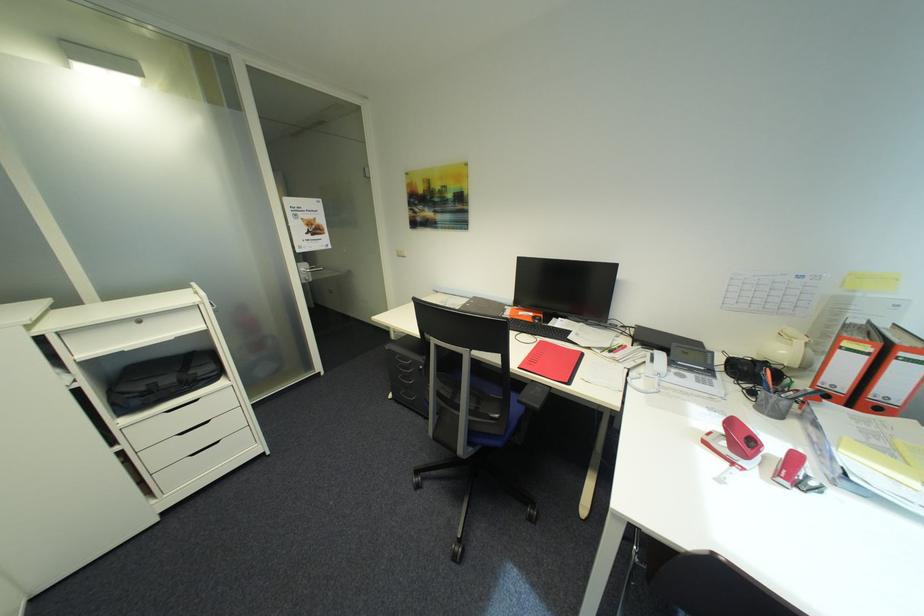
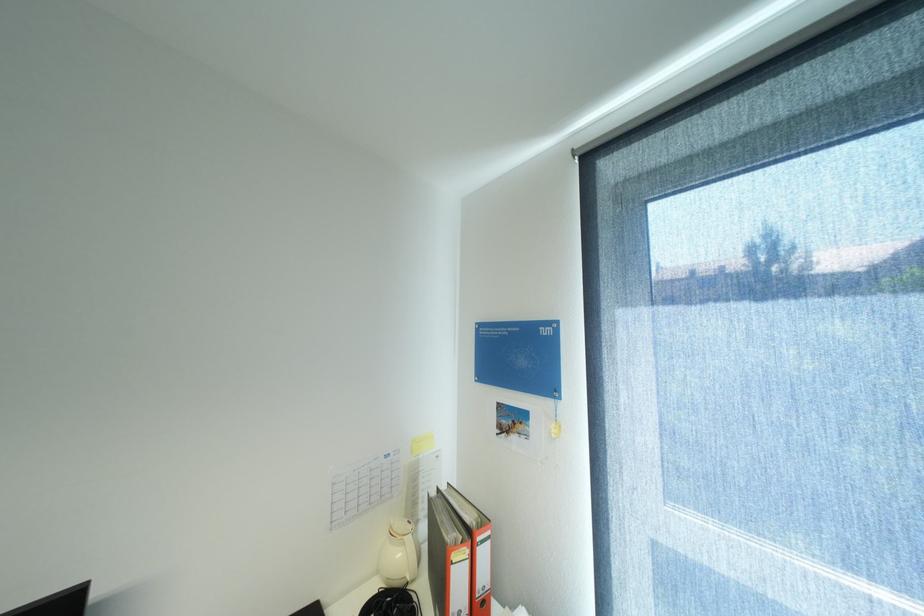
Find the pixel in the second image that matches (x=879, y=398) in the first image.

(484, 597)